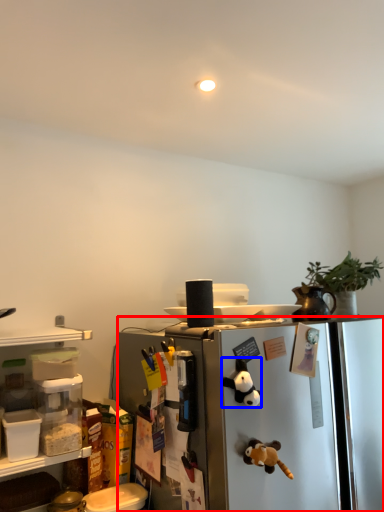
Question: Which point is closer to the camera, refrigerator (highlighted by a red box) or toy (highlighted by a blue box)?

Choices:
 (A) refrigerator
 (B) toy

Answer: (A)